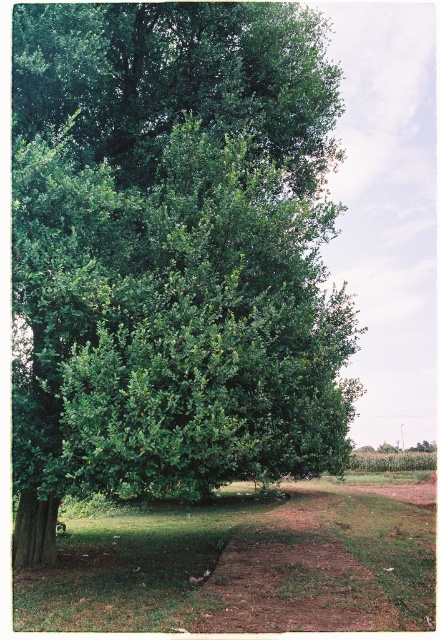
Question: Estimate the real-world distances between objects in this image. Which object is farther from the green leafy tree at center?

Choices:
 (A) green leafy tree at upper center
 (B) green leafy grass at lower center

Answer: (B)

Question: Among these points, which one is farthest from the camera?

Choices:
 (A) (370, 540)
 (B) (77, 484)

Answer: (A)

Question: Estimate the real-world distances between objects in this image. Which object is farther from the green leafy grass at lower center?

Choices:
 (A) green leafy tree at center
 (B) green leafy tree at upper center

Answer: (A)

Question: Is green leafy grass at lower center in front of green leafy tree at upper center?

Choices:
 (A) yes
 (B) no

Answer: (A)

Question: Is green leafy tree at center below green leafy tree at upper center?

Choices:
 (A) no
 (B) yes

Answer: (B)

Question: Does green leafy tree at center have a larger size compared to green leafy grass at lower center?

Choices:
 (A) yes
 (B) no

Answer: (B)